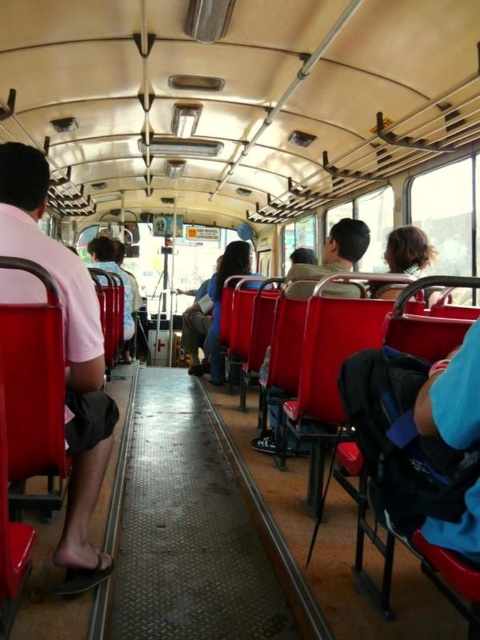
Is pink cotton shirt at left positioned behind matte red seat at center?

No.

Who is more distant from viewer, (94, 580) or (104, 280)?

Point (104, 280)

The height and width of the screenshot is (640, 480). Identify the location of pink cotton shirt at left. (64, 356).